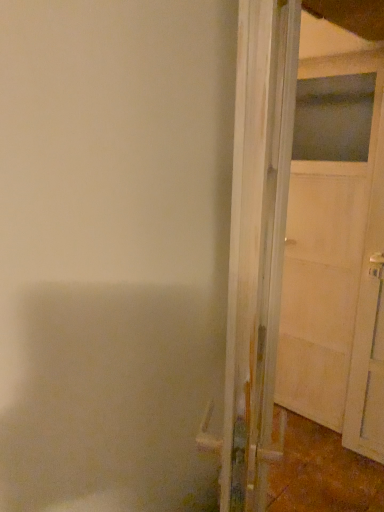
What do you see at coordinates (328, 249) in the screenshot? I see `white matte door at right, the second door when ordered from left to right` at bounding box center [328, 249].

Image resolution: width=384 pixels, height=512 pixels. What are the coordinates of `white matte door at right, which ranks as the first door in right-to-left order` in the screenshot? It's located at 328,249.

This screenshot has width=384, height=512. In order to click on white wood door at right, which is the 2th door from right to left in this screenshot , I will do `click(257, 242)`.

Image resolution: width=384 pixels, height=512 pixels. What do you see at coordinates (257, 242) in the screenshot?
I see `white wood door at right, which is the first door in left-to-right order` at bounding box center [257, 242].

What is the approximate width of white wood door at right, which is the 2th door from right to left?

It is 17.92 centimeters.

Identify the location of white matte door at right, the second door when ordered from left to right. (328, 249).

Can you confirm if white matte door at right, the second door when ordered from left to right, is positioned to the left of white wood door at right, which is the first door in left-to-right order?

No, white matte door at right, the second door when ordered from left to right, is not to the left of white wood door at right, which is the first door in left-to-right order.

Which is behind, white matte door at right, which ranks as the first door in right-to-left order, or white wood door at right, which is the 2th door from right to left?

white matte door at right, which ranks as the first door in right-to-left order, is behind.

Is point (373, 98) positioned behind point (261, 458)?

Yes, it is behind point (261, 458).

From the image's perspective, between white matte door at right, the second door when ordered from left to right, and white wood door at right, which is the first door in left-to-right order, who is located below?

white wood door at right, which is the first door in left-to-right order, is shown below in the image.

From a real-world perspective, which object stands above the other?

From a 3D spatial view, white wood door at right, which is the 2th door from right to left, is above.

Is white matte door at right, the second door when ordered from left to right, thinner than white wood door at right, which is the first door in left-to-right order?

Indeed, white matte door at right, the second door when ordered from left to right, has a lesser width compared to white wood door at right, which is the first door in left-to-right order.

Who is shorter, white matte door at right, the second door when ordered from left to right, or white wood door at right, which is the first door in left-to-right order?

white wood door at right, which is the first door in left-to-right order.

Does white matte door at right, the second door when ordered from left to right, have a larger size compared to white wood door at right, which is the 2th door from right to left?

Incorrect, white matte door at right, the second door when ordered from left to right, is not larger than white wood door at right, which is the 2th door from right to left.

In the scene shown: Is white matte door at right, the second door when ordered from left to right, outside of white wood door at right, which is the 2th door from right to left?

Yes, white matte door at right, the second door when ordered from left to right, is located beyond the bounds of white wood door at right, which is the 2th door from right to left.

Are white matte door at right, which ranks as the first door in right-to-left order, and white wood door at right, which is the 2th door from right to left, beside each other?

No, white matte door at right, which ranks as the first door in right-to-left order, is not making contact with white wood door at right, which is the 2th door from right to left.

Does white matte door at right, the second door when ordered from left to right, turn towards white wood door at right, which is the first door in left-to-right order?

Yes, white matte door at right, the second door when ordered from left to right, faces towards white wood door at right, which is the first door in left-to-right order.

Can you tell me how much white matte door at right, which ranks as the first door in right-to-left order, and white wood door at right, which is the 2th door from right to left, differ in facing direction?

white matte door at right, which ranks as the first door in right-to-left order, and white wood door at right, which is the 2th door from right to left, are facing 120 degrees away from each other.

You are a GUI agent. You are given a task and a screenshot of the screen. Output one action in this format:
    pyautogui.click(x=<x>, y=<y>)
    Task: Click on the door located behind the white wood door at right, which is the 2th door from right to left
    
    Given the screenshot: What is the action you would take?
    tap(328, 249)

Is white wood door at right, which is the 2th door from right to left, to the right of white matte door at right, the second door when ordered from left to right, from the viewer's perspective?

Incorrect, white wood door at right, which is the 2th door from right to left, is not on the right side of white matte door at right, the second door when ordered from left to right.

Does white wood door at right, which is the 2th door from right to left, lie behind white matte door at right, the second door when ordered from left to right?

No, it is in front of white matte door at right, the second door when ordered from left to right.

Is point (264, 10) in front of point (377, 157)?

Yes, point (264, 10) is closer to viewer.

From the image's perspective, is white wood door at right, which is the first door in left-to-right order, above white matte door at right, which ranks as the first door in right-to-left order?

Incorrect, from the image's perspective, white wood door at right, which is the first door in left-to-right order, is lower than white matte door at right, which ranks as the first door in right-to-left order.

In the scene shown: From a real-world perspective, relative to white matte door at right, the second door when ordered from left to right, is white wood door at right, which is the first door in left-to-right order, vertically above or below?

In terms of real-world spatial position, white wood door at right, which is the first door in left-to-right order, is above white matte door at right, the second door when ordered from left to right.

Looking at this image, is white wood door at right, which is the 2th door from right to left, wider than white matte door at right, the second door when ordered from left to right?

Indeed, white wood door at right, which is the 2th door from right to left, has a greater width compared to white matte door at right, the second door when ordered from left to right.

Considering the sizes of objects white wood door at right, which is the 2th door from right to left, and white matte door at right, the second door when ordered from left to right, in the image provided, who is shorter, white wood door at right, which is the 2th door from right to left, or white matte door at right, the second door when ordered from left to right,?

Standing shorter between the two is white wood door at right, which is the 2th door from right to left.

Looking at this image, looking at the image, does white wood door at right, which is the 2th door from right to left, seem bigger or smaller compared to white matte door at right, the second door when ordered from left to right?

white wood door at right, which is the 2th door from right to left, is bigger than white matte door at right, the second door when ordered from left to right.

Is white wood door at right, which is the 2th door from right to left, inside the boundaries of white matte door at right, the second door when ordered from left to right, or outside?

white wood door at right, which is the 2th door from right to left, is spatially situated outside white matte door at right, the second door when ordered from left to right.

Would you consider white wood door at right, which is the first door in left-to-right order, to be distant from white matte door at right, which ranks as the first door in right-to-left order?

Yes, white wood door at right, which is the first door in left-to-right order, and white matte door at right, which ranks as the first door in right-to-left order, are quite far apart.

Is white wood door at right, which is the first door in left-to-right order, oriented towards white matte door at right, the second door when ordered from left to right?

Yes, white wood door at right, which is the first door in left-to-right order, is aimed at white matte door at right, the second door when ordered from left to right.

How many degrees apart are the facing directions of white wood door at right, which is the 2th door from right to left, and white matte door at right, which ranks as the first door in right-to-left order?

120 degrees separate the facing orientations of white wood door at right, which is the 2th door from right to left, and white matte door at right, which ranks as the first door in right-to-left order.

From the picture: Measure the distance from white wood door at right, which is the first door in left-to-right order, to white matte door at right, the second door when ordered from left to right.

The distance of white wood door at right, which is the first door in left-to-right order, from white matte door at right, the second door when ordered from left to right, is 3.66 feet.

Identify the location of door lying in front of the white matte door at right, which ranks as the first door in right-to-left order. (257, 242).

At what (x,y) coordinates should I click in order to perform the action: click on door below the white matte door at right, the second door when ordered from left to right (from the image's perspective). Please return your answer as a coordinate pair (x, y). Looking at the image, I should click on (257, 242).

You are a GUI agent. You are given a task and a screenshot of the screen. Output one action in this format:
    pyautogui.click(x=<x>, y=<y>)
    Task: Click on the door on the right of white wood door at right, which is the first door in left-to-right order
    The width and height of the screenshot is (384, 512).
    Given the screenshot: What is the action you would take?
    pyautogui.click(x=328, y=249)